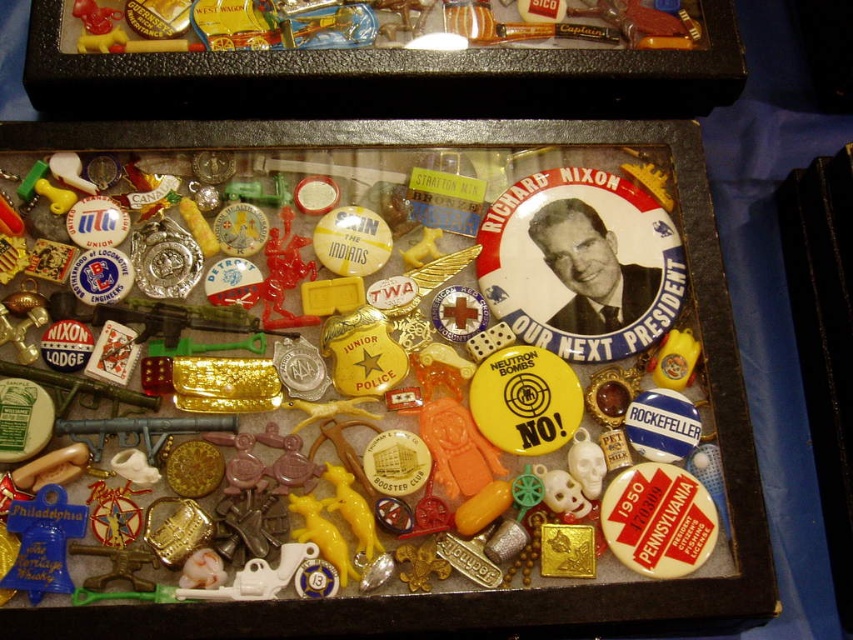
Is clear plastic box at center thinner than matte plastic playing card at center-left?

No.

Which is below, clear plastic box at center or matte plastic playing card at center-left?

clear plastic box at center is below.

Identify the location of clear plastic box at center. [x=469, y=593].